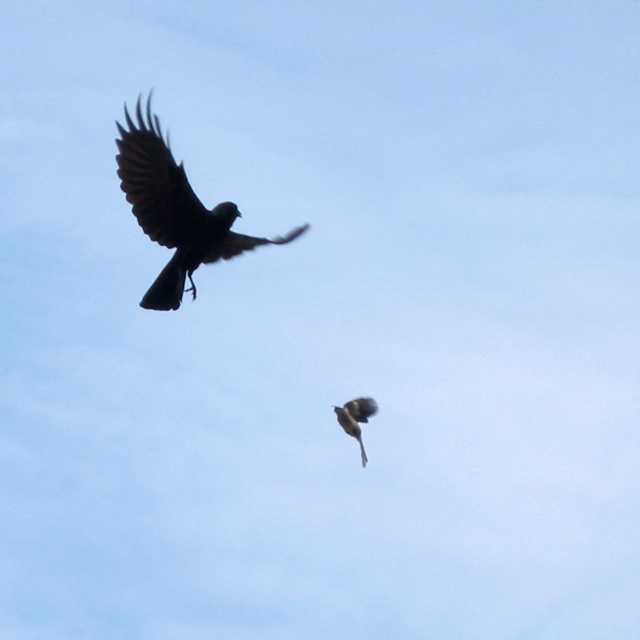
From the picture: Is silhouette glossy bird at upper left further to camera compared to silvery metallic bird at lower center?

Yes, silhouette glossy bird at upper left is further from the viewer.

Between point (128, 156) and point (358, 429), which one is positioned behind?

Positioned behind is point (128, 156).

Image resolution: width=640 pixels, height=640 pixels. What are the coordinates of `silhouette glossy bird at upper left` in the screenshot? It's located at (176, 211).